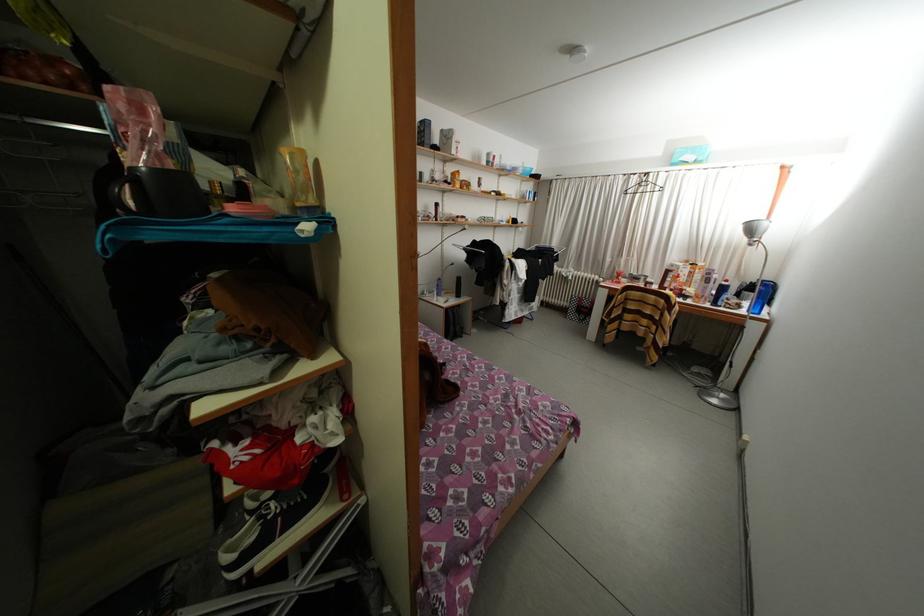
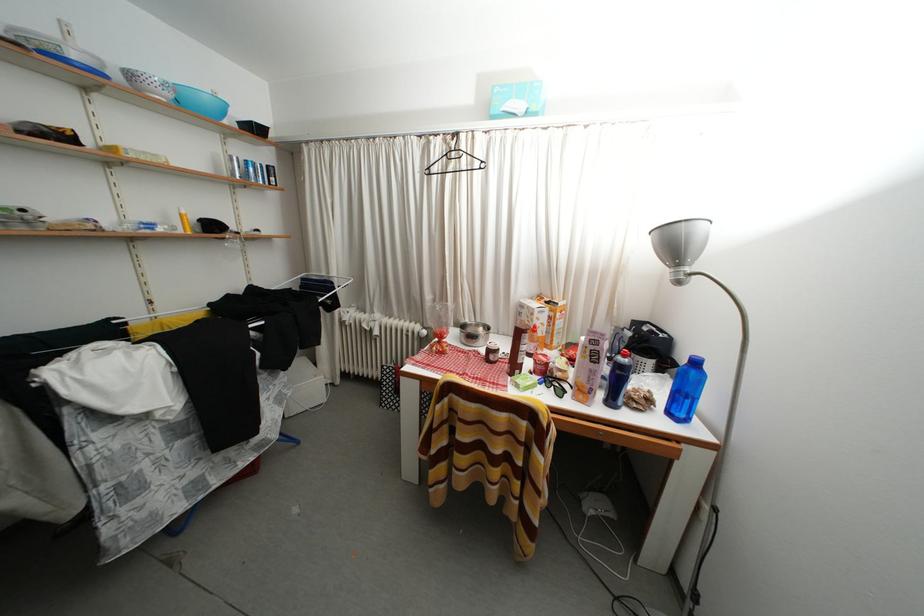
Find the pixel in the second image that matches (x=723, y=309) in the first image.

(618, 408)